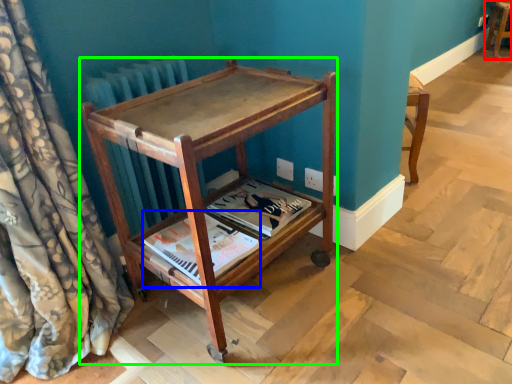
Question: Estimate the real-world distances between objects in this image. Which object is farther from furniture (highlighted by a red box), magazine (highlighted by a blue box) or furniture (highlighted by a green box)?

Choices:
 (A) magazine
 (B) furniture

Answer: (A)